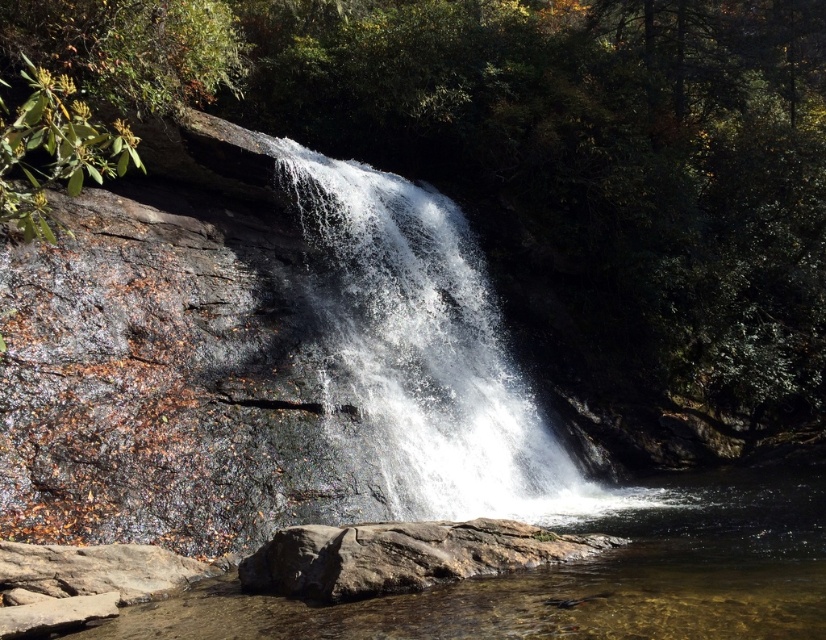
Does point (344, 307) lie in front of point (525, 595)?

No.

Who is lower down, white frothy water at center or clear water at center?

clear water at center

Describe the element at coordinates (425, 353) in the screenshot. I see `white frothy water at center` at that location.

This screenshot has width=826, height=640. Identify the location of white frothy water at center. (425, 353).

This screenshot has width=826, height=640. What are the coordinates of `white frothy water at center` in the screenshot? It's located at (425, 353).

Can you confirm if white frothy water at center is shorter than brown rough rock at lower center?

In fact, white frothy water at center may be taller than brown rough rock at lower center.

Is point (350, 192) positioned behind point (516, 536)?

Yes, point (350, 192) is farther from viewer.

Where is `white frothy water at center`? The height and width of the screenshot is (640, 826). white frothy water at center is located at coordinates (425, 353).

Does clear water at center come behind brown rough rock at lower center?

No, it is not.

Is point (390, 632) farther from viewer compared to point (413, 573)?

No, (390, 632) is in front of (413, 573).

Identify the location of clear water at center. The height and width of the screenshot is (640, 826). (578, 579).

Locate an element on the screen. This screenshot has height=640, width=826. clear water at center is located at coordinates (578, 579).